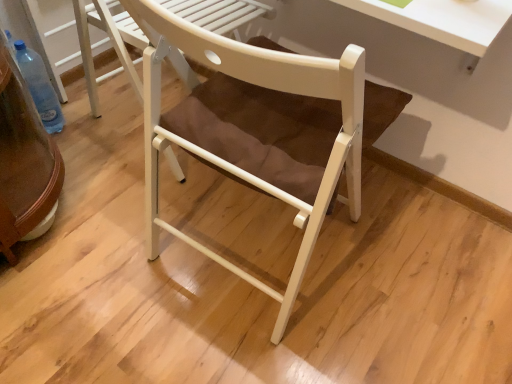
This screenshot has width=512, height=384. In order to click on free space in front of white matte chair at center, the 2th chair when ordered from front to back in this screenshot , I will do `click(116, 215)`.